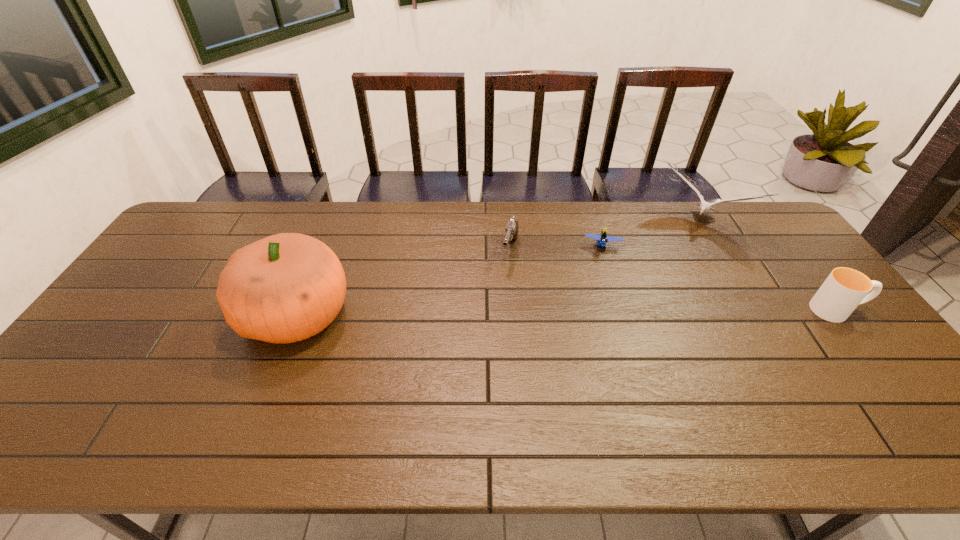
The width and height of the screenshot is (960, 540). Find the location of `free space at the far left corner`. free space at the far left corner is located at coordinates (204, 234).

The image size is (960, 540). In order to click on free location at the far right corner in this screenshot , I will do `click(750, 229)`.

Locate an element on the screen. The image size is (960, 540). vacant space in between the leftmost object and the gull is located at coordinates (498, 268).

The width and height of the screenshot is (960, 540). I want to click on free space between the Lego and the pumpkin, so click(x=450, y=280).

You are a GUI agent. You are given a task and a screenshot of the screen. Output one action in this format:
    pyautogui.click(x=<x>, y=<y>)
    Task: Click on the free spot between the rightmost object and the fourth shortest object
    The image size is (960, 540).
    Given the screenshot: What is the action you would take?
    pyautogui.click(x=768, y=266)

In order to click on vacant point located between the rightmost object and the second object from left to right in this screenshot , I will do `click(674, 280)`.

Where is `vacant point located between the rightmost object and the gull`? vacant point located between the rightmost object and the gull is located at coordinates (768, 266).

This screenshot has height=540, width=960. Find the location of `vacant region between the leftmost object and the fourth object from left to right`. vacant region between the leftmost object and the fourth object from left to right is located at coordinates (498, 268).

Image resolution: width=960 pixels, height=540 pixels. I want to click on unoccupied position between the pumpkin and the cup, so click(x=567, y=312).

I want to click on vacant area that lies between the rightmost object and the tallest object, so [567, 312].